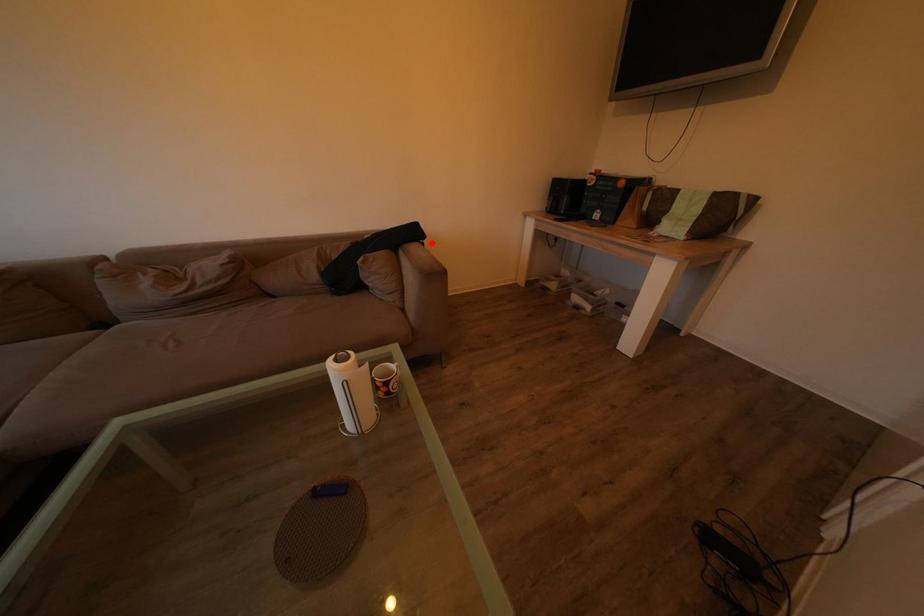
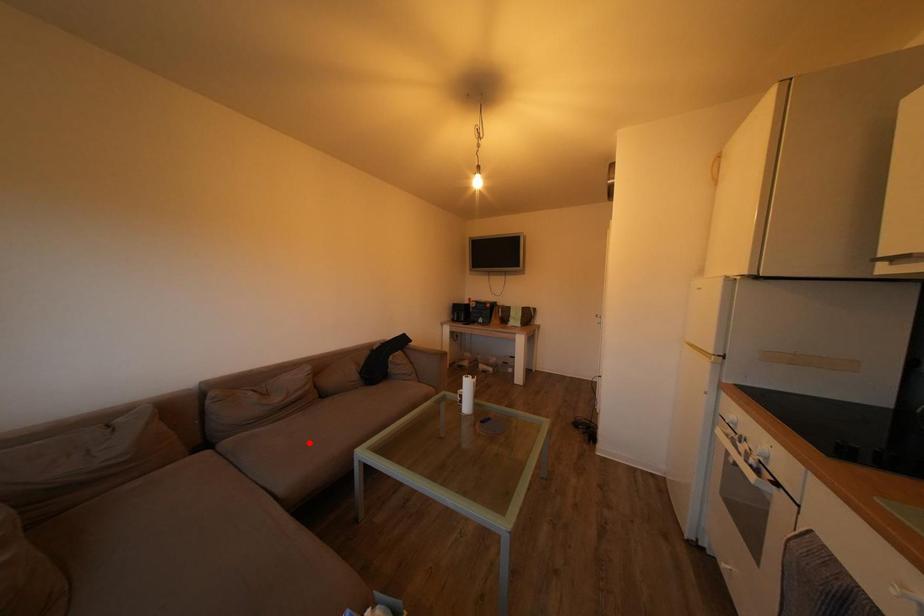
I am providing you with two images of the same scene from different viewpoints. A red point is marked on the first image and another point is marked on the second image. Does the point marked in image1 correspond to the same location as the one in image2?

No